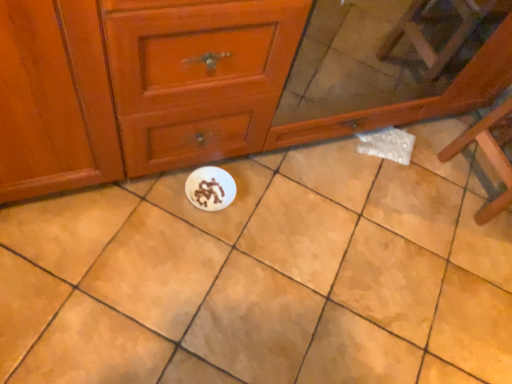
This screenshot has height=384, width=512. I want to click on free area in between wooden chair at right and white matte paper plate at center, so click(350, 197).